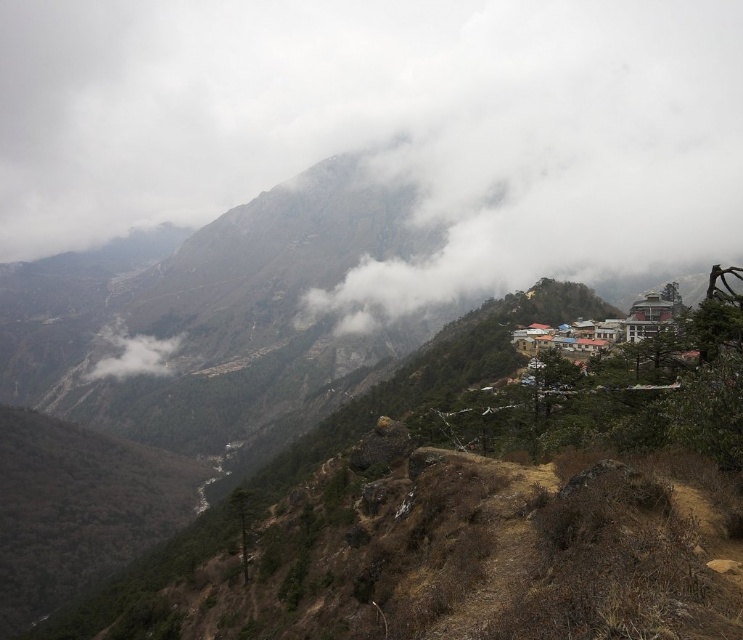
You are a hiker planning to take a photo of the white fluffy cloud at upper center and the white fluffy cloud at lower left from the village. What is the minimum distance you need to walk to capture both clouds in the same frame?

The distance between the white fluffy cloud at upper center and the white fluffy cloud at lower left is 900.57 feet. To capture both in the same frame, you need to position yourself at a point where both are visible, but the exact walking distance depends on your current location and the camera lens used. However, the clouds are 900.57 feet apart.

You are a photographer planning to capture the mountain landscape. You want to ensure that both the white fluffy cloud at upper center and the white fluffy cloud at lower left are visible in your shot. Which cloud should you prioritize framing closer to the center of your photo to maintain their visibility?

You should prioritize framing the white fluffy cloud at upper center closer to the center of your photo because it is larger in width than the white fluffy cloud at lower left, making it more prominent and easier to keep visible in the composition.